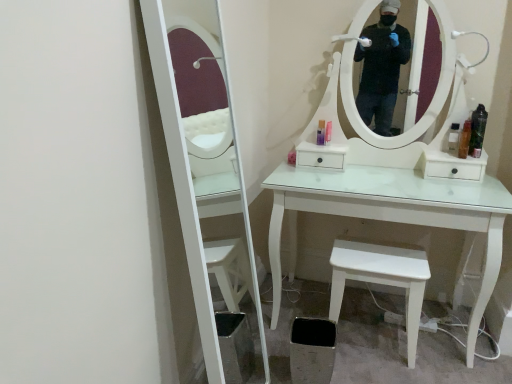
Question: Looking at their shapes, would you say translucent plastic bottle at right, acting as the 2th toiletry starting from the right, is wider or thinner than pink plastic bottle at center, which appears as the second toiletry when viewed from the left?

Choices:
 (A) thin
 (B) wide

Answer: (B)

Question: In terms of size, does translucent plastic bottle at right, acting as the 2th toiletry starting from the right, appear bigger or smaller than pink plastic bottle at center, which appears as the second toiletry when viewed from the left?

Choices:
 (A) small
 (B) big

Answer: (B)

Question: Considering the real-world distances, which object is farthest from the pink plastic bottle at center, marked as the 4th toiletry in a right-to-left arrangement?

Choices:
 (A) white matte stool at lower right
 (B) clear plastic bottle at right, which is the 3th toiletry from right to left
 (C) translucent plastic bottle at right, acting as the 2th toiletry starting from the right
 (D) matte purple bottle at center, placed as the fifth toiletry when sorted from right to left
 (E) translucent plastic bottle at right, the 1th toiletry viewed from the right

Answer: (A)

Question: Which is farther from the translucent plastic bottle at right, acting as the 2th toiletry starting from the right?

Choices:
 (A) pink plastic bottle at center, marked as the 4th toiletry in a right-to-left arrangement
 (B) clear plastic bottle at right, the third toiletry when ordered from left to right
 (C) translucent plastic bottle at right, the 1th toiletry viewed from the right
 (D) matte purple bottle at center, the 1th toiletry from the left
 (E) white matte stool at lower right

Answer: (E)